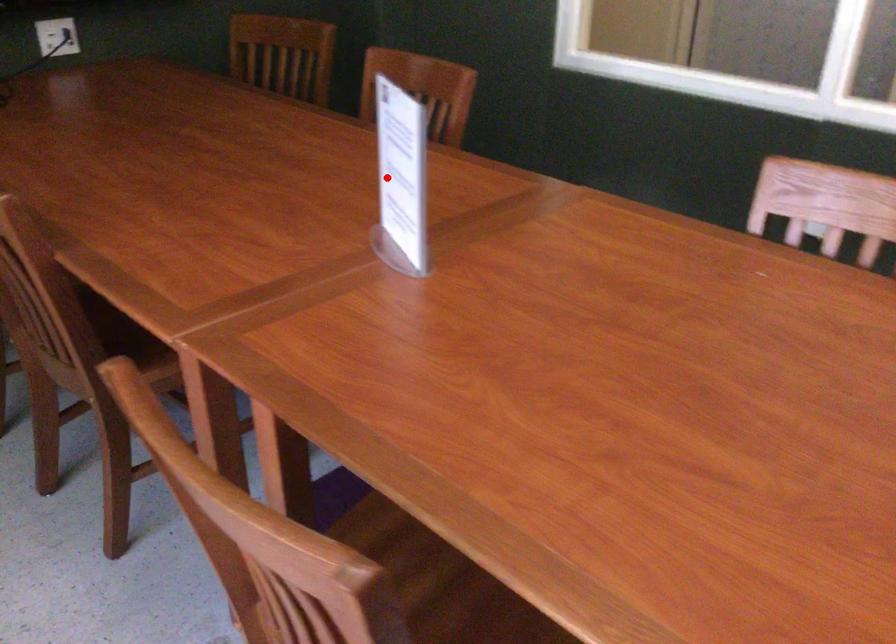
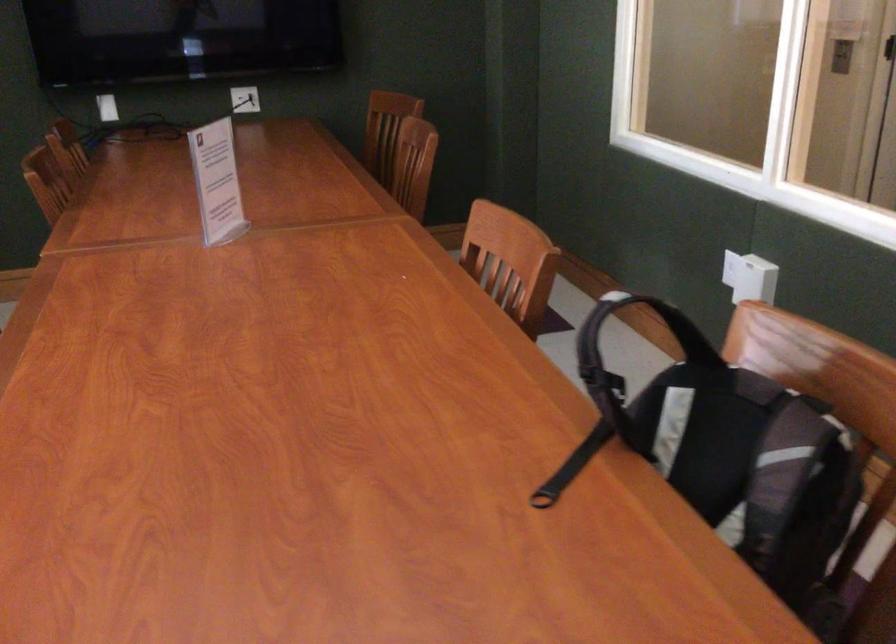
Find the pixel in the second image that matches the highlighted location in the first image.

(217, 182)